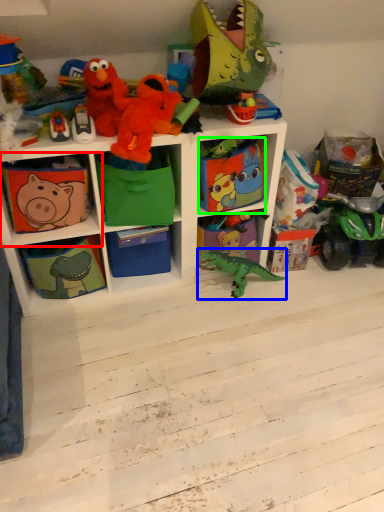
Question: Which is nearer to the shelf (highlighted by a red box)? toy (highlighted by a blue box) or box (highlighted by a green box).

Choices:
 (A) toy
 (B) box

Answer: (B)